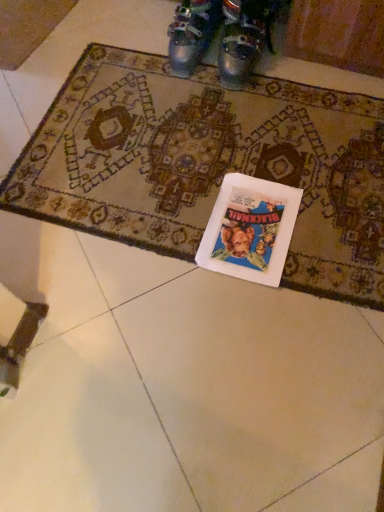
Identify the location of free point in front of metallic silver boots at upper center, which is counted as the first footwear, starting from the left. (186, 90).